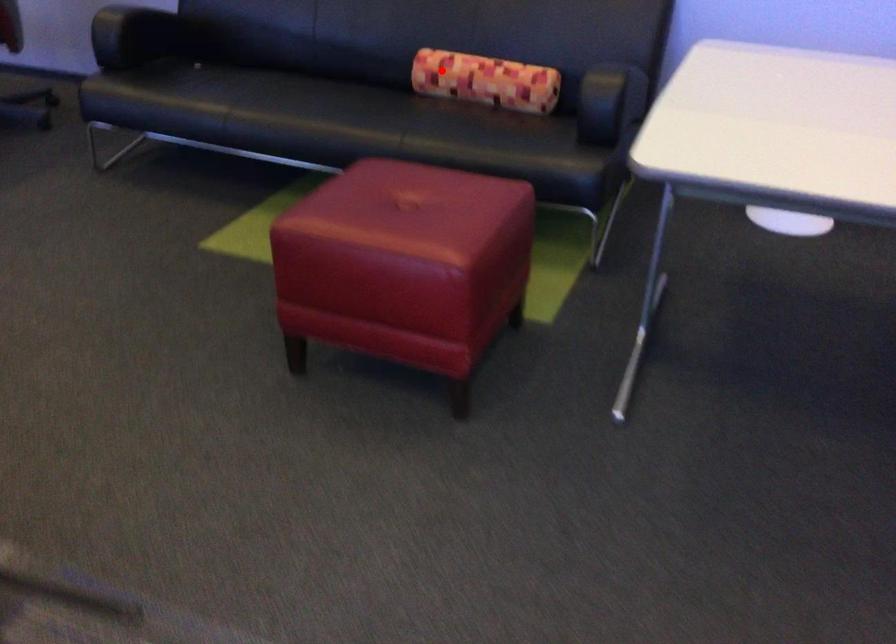
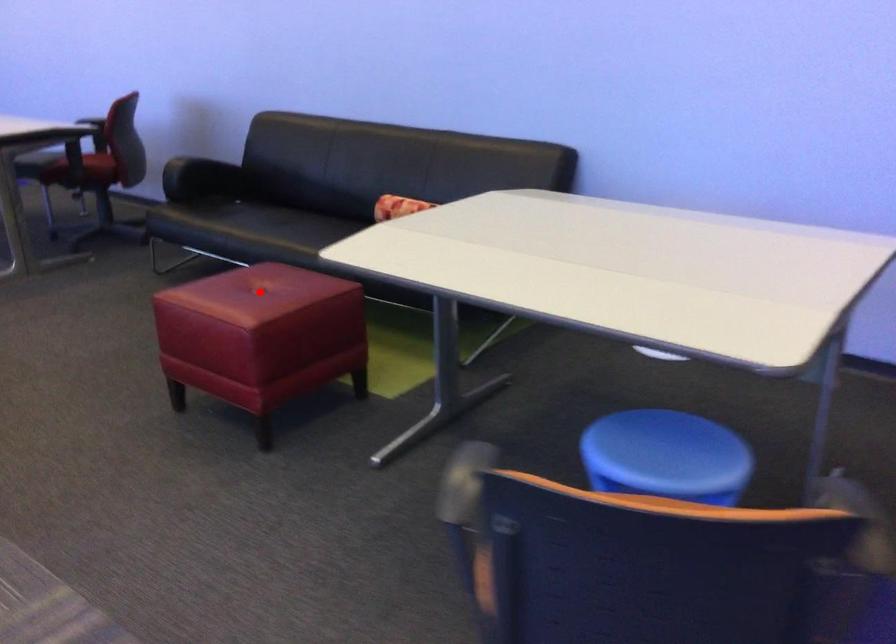
I am providing you with two images of the same scene from different viewpoints. A red point is marked on the first image and another point is marked on the second image. Is the marked point in image1 the same physical position as the marked point in image2?

No